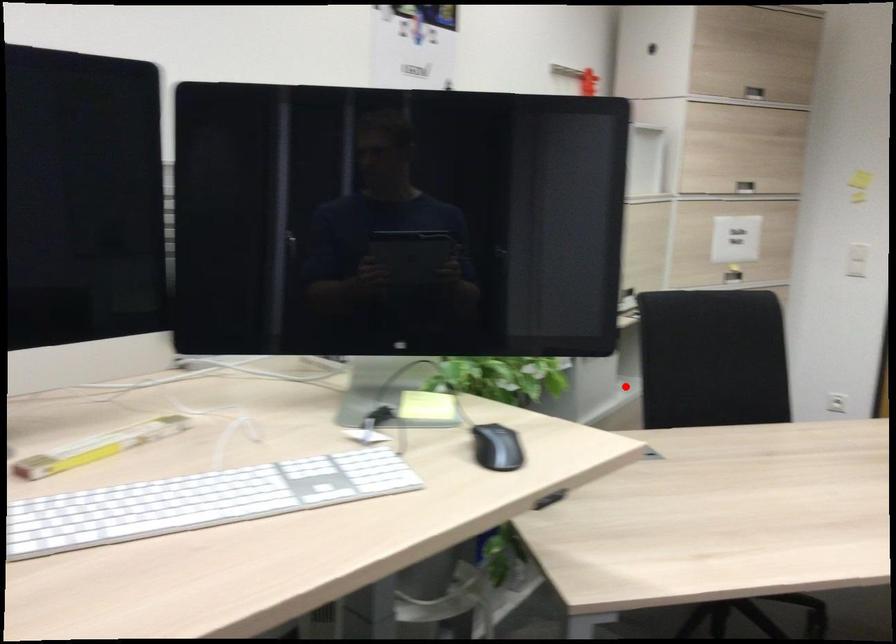
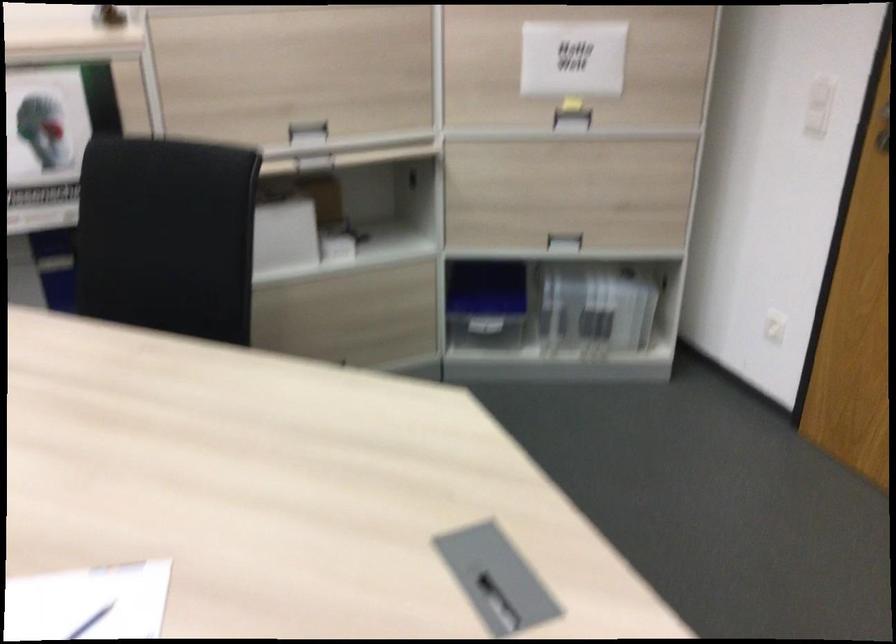
Question: I am providing you with two images of the same scene from different viewpoints. Image1 has a red point marked. In image2, the corresponding 3D location appears at what relative position? Reply with the corresponding letter.

Choices:
 (A) Closer
 (B) Farther

Answer: (A)